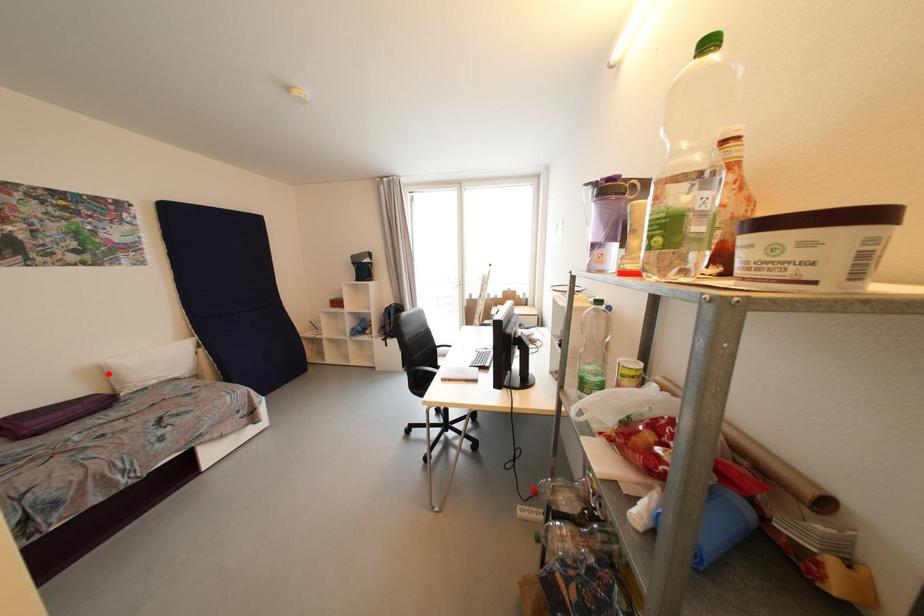
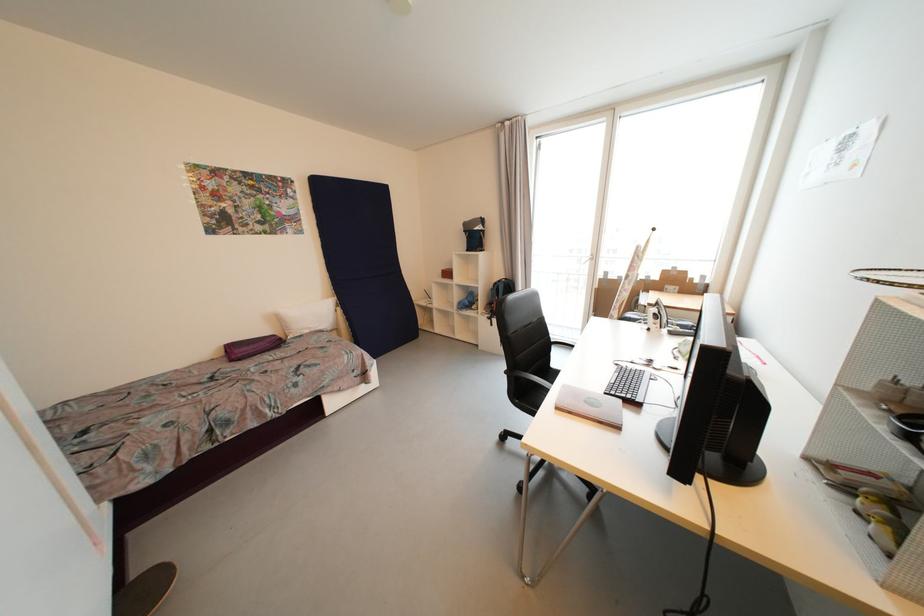
Where in the second image is the point corresponding to the highlighted location from the first image?

(283, 321)